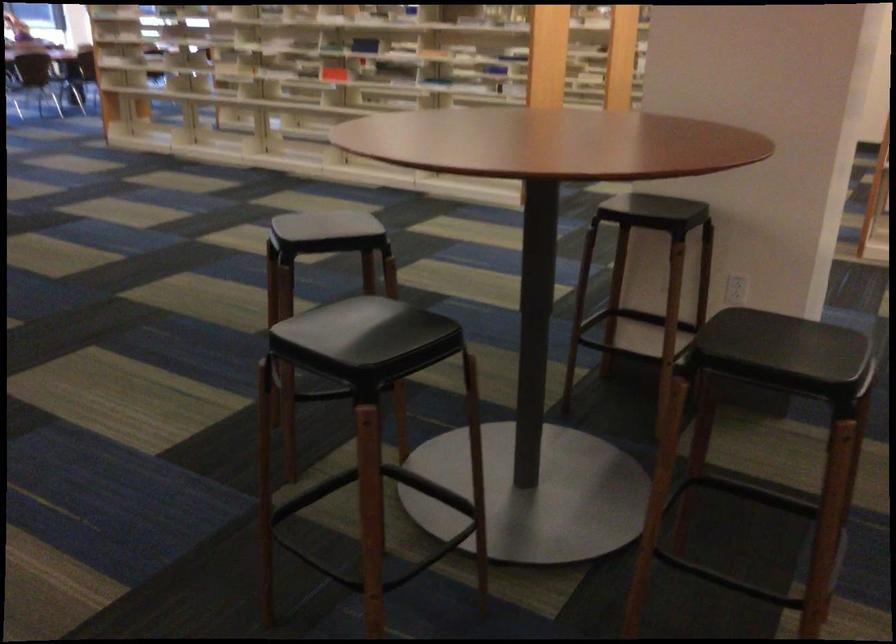
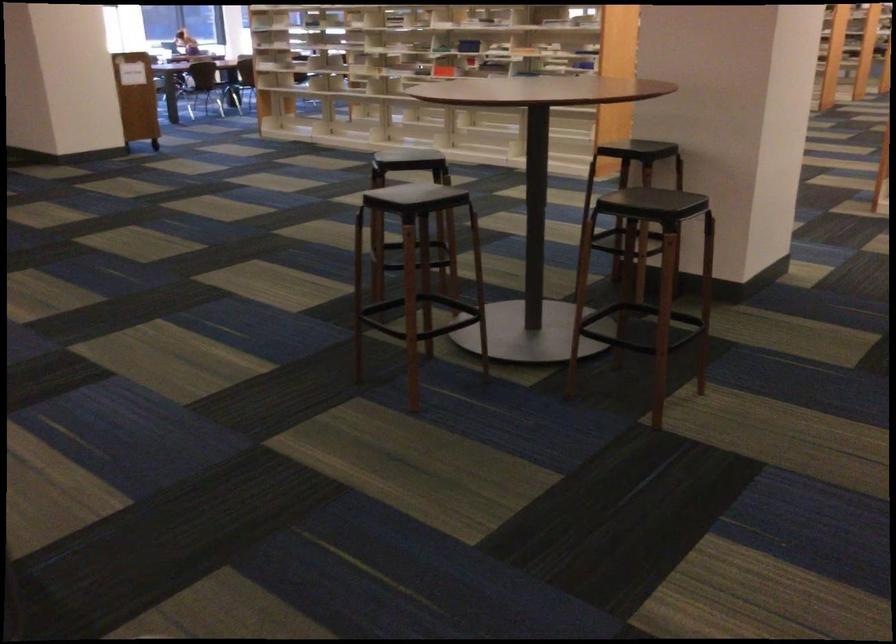
Locate, in the second image, the point that corresponds to point 320,88 in the first image.

(418, 75)